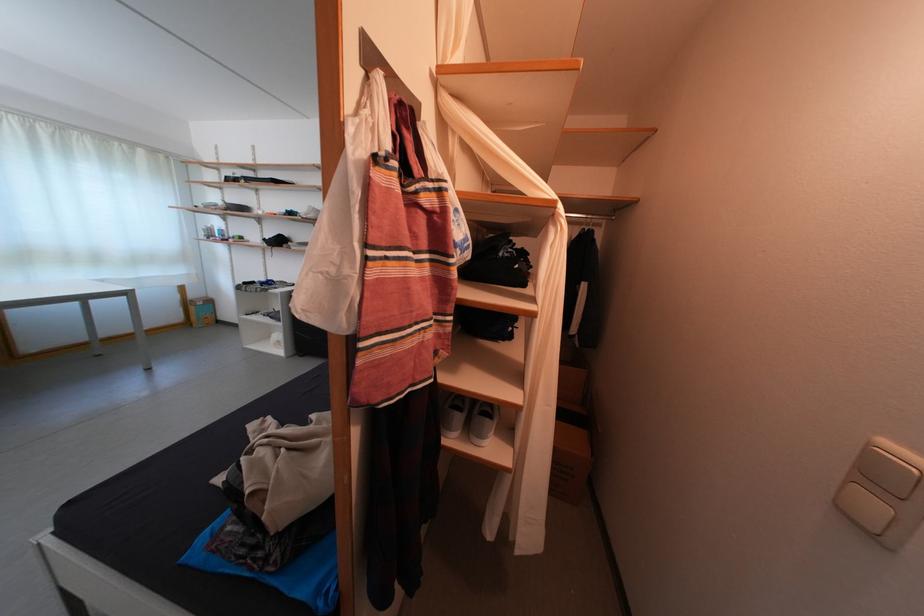
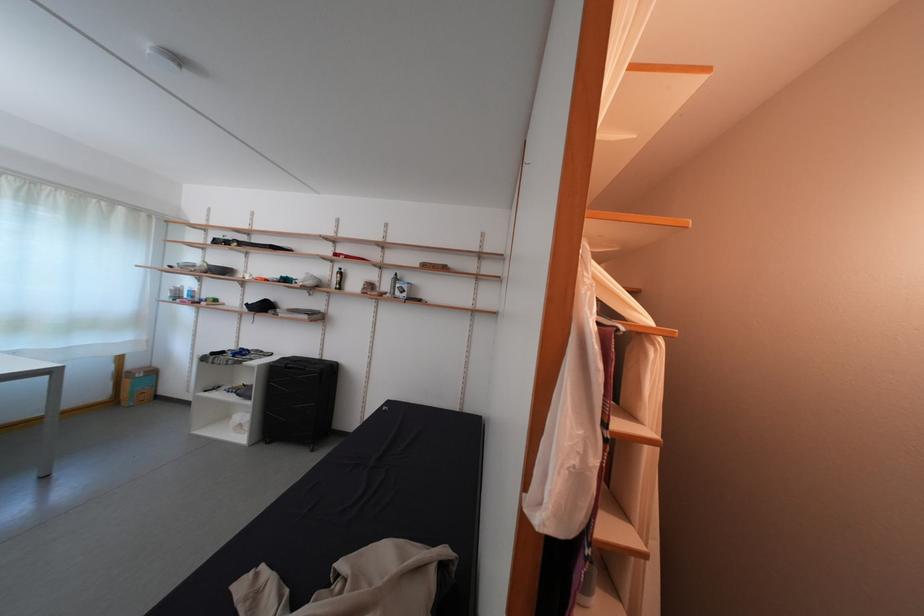
Question: The images are taken continuously from a first-person perspective. In which direction is your viewpoint rotating?

Choices:
 (A) Left
 (B) Right
 (C) Up
 (D) Down

Answer: (C)